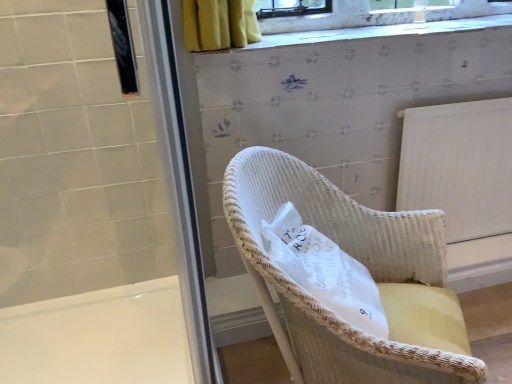
Question: Does white wicker chair at center have a smaller size compared to white glossy bath at lower left?

Choices:
 (A) yes
 (B) no

Answer: (A)

Question: Is white wicker chair at center positioned with its back to white glossy bath at lower left?

Choices:
 (A) no
 (B) yes

Answer: (B)

Question: Considering the relative sizes of white wicker chair at center and white glossy bath at lower left in the image provided, is white wicker chair at center taller than white glossy bath at lower left?

Choices:
 (A) no
 (B) yes

Answer: (B)

Question: Is white wicker chair at center at the right side of white glossy bath at lower left?

Choices:
 (A) no
 (B) yes

Answer: (B)

Question: Is white wicker chair at center outside white glossy bath at lower left?

Choices:
 (A) yes
 (B) no

Answer: (A)

Question: Relative to white wicker chair at center, is white glossy screen door at upper left, the 2th screen door in the right-to-left sequence, in front or behind?

Choices:
 (A) front
 (B) behind

Answer: (B)

Question: Choose the correct answer: Is white glossy screen door at upper left, which appears as the 1th screen door when viewed from the left, inside white wicker chair at center or outside it?

Choices:
 (A) outside
 (B) inside

Answer: (A)

Question: From their relative heights in the image, would you say white glossy screen door at upper left, which appears as the 1th screen door when viewed from the left, is taller or shorter than white wicker chair at center?

Choices:
 (A) short
 (B) tall

Answer: (B)

Question: Is white glossy screen door at upper left, which appears as the 1th screen door when viewed from the left, wider or thinner than white wicker chair at center?

Choices:
 (A) wide
 (B) thin

Answer: (B)

Question: Is white wicker chair at center situated inside woven white chair at center or outside?

Choices:
 (A) outside
 (B) inside

Answer: (B)

Question: In terms of width, does white wicker chair at center look wider or thinner when compared to woven white chair at center?

Choices:
 (A) wide
 (B) thin

Answer: (B)

Question: Would you say white wicker chair at center is to the left or to the right of woven white chair at center in the picture?

Choices:
 (A) left
 (B) right

Answer: (A)

Question: Is white wicker chair at center bigger or smaller than woven white chair at center?

Choices:
 (A) small
 (B) big

Answer: (A)

Question: Considering the positions of white wicker chair at center and white glossy bath at lower left in the image, is white wicker chair at center taller or shorter than white glossy bath at lower left?

Choices:
 (A) tall
 (B) short

Answer: (A)

Question: From a real-world perspective, relative to white glossy bath at lower left, is white wicker chair at center vertically above or below?

Choices:
 (A) above
 (B) below

Answer: (A)